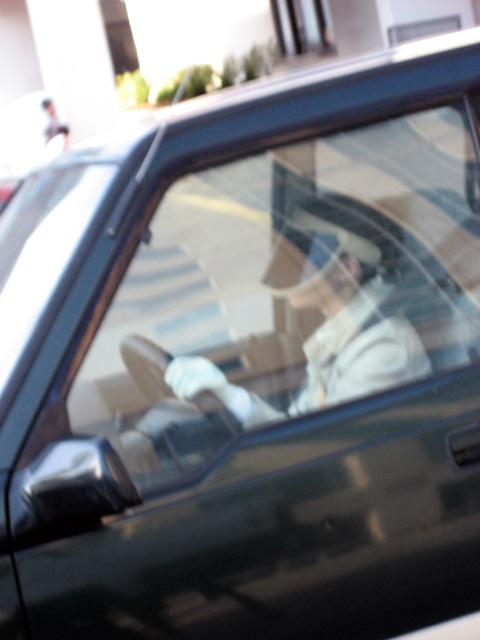
You are standing outside the car and want to know if you can see the white matte jacket at center through the transparent glass window at upper center. Based on their positions, can you see it?

The white matte jacket at center is 11.48 meters away from the transparent glass window at upper center. Since the jacket is inside the car and the window is transparent, you can see the white matte jacket at center through the transparent glass window at upper center from outside the car.

You are a delivery person who needs to check the weather outside through the transparent glass window at upper center while wearing the white matte jacket at center. Can the jacket interfere with your ability to see through the window?

The white matte jacket at center has a smaller width than the transparent glass window at upper center, so it won not block your view of the window.

You are inside the car and looking at the driver side door. There are two points marked on the door, one at point coordinates (394, 358) and another at (288, 22). Which point is closer to you?

Point (394, 358) is closer to the camera than point (288, 22).